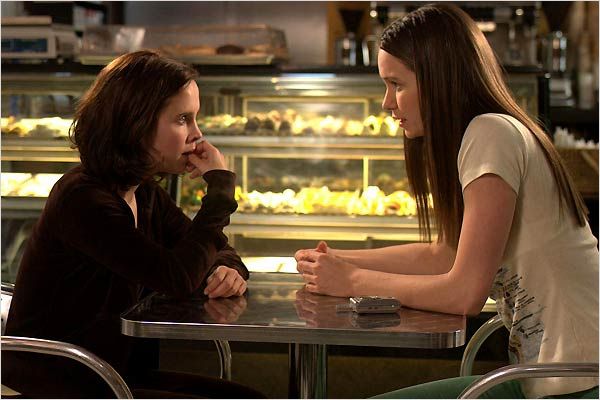
Image resolution: width=600 pixels, height=400 pixels. I want to click on seats, so click(509, 374), click(81, 359).